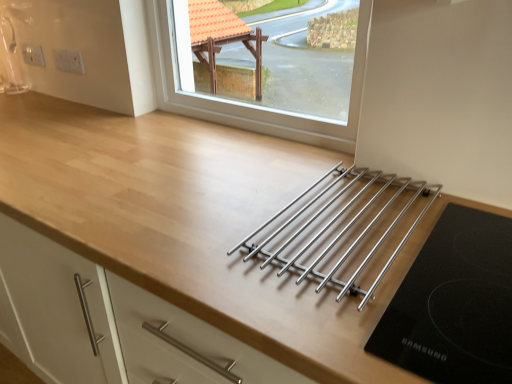
Question: Is polished stainless steel rack at center bigger than white plastic electrical outlet at upper left, arranged as the first electric outlet when viewed from the left?

Choices:
 (A) yes
 (B) no

Answer: (A)

Question: Does polished stainless steel rack at center appear on the left side of white plastic electrical outlet at upper left, the 2th electric outlet from the front?

Choices:
 (A) yes
 (B) no

Answer: (B)

Question: Would you consider polished stainless steel rack at center to be distant from white plastic electrical outlet at upper left, arranged as the second electric outlet when viewed from the right?

Choices:
 (A) yes
 (B) no

Answer: (A)

Question: Is polished stainless steel rack at center to the right of white plastic electrical outlet at upper left, which is counted as the 1th electric outlet, starting from the back, from the viewer's perspective?

Choices:
 (A) yes
 (B) no

Answer: (A)

Question: Is polished stainless steel rack at center facing away from white plastic electrical outlet at upper left, arranged as the second electric outlet when viewed from the right?

Choices:
 (A) no
 (B) yes

Answer: (A)

Question: From a real-world perspective, is polished stainless steel rack at center physically above white plastic electrical outlet at upper left, which is counted as the 1th electric outlet, starting from the back?

Choices:
 (A) no
 (B) yes

Answer: (A)

Question: Considering the relative sizes of polished stainless steel rack at center and clear glass window at upper center in the image provided, is polished stainless steel rack at center bigger than clear glass window at upper center?

Choices:
 (A) yes
 (B) no

Answer: (B)

Question: Are polished stainless steel rack at center and clear glass window at upper center located far from each other?

Choices:
 (A) no
 (B) yes

Answer: (A)

Question: Is polished stainless steel rack at center thinner than clear glass window at upper center?

Choices:
 (A) no
 (B) yes

Answer: (A)

Question: Is polished stainless steel rack at center smaller than clear glass window at upper center?

Choices:
 (A) yes
 (B) no

Answer: (A)

Question: Is polished stainless steel rack at center oriented away from clear glass window at upper center?

Choices:
 (A) no
 (B) yes

Answer: (A)

Question: Is polished stainless steel rack at center completely or partially outside of clear glass window at upper center?

Choices:
 (A) no
 (B) yes

Answer: (B)

Question: Can you confirm if clear glass window at upper center is wider than white plastic electrical outlet at upper left, which is counted as the 1th electric outlet, starting from the back?

Choices:
 (A) yes
 (B) no

Answer: (A)